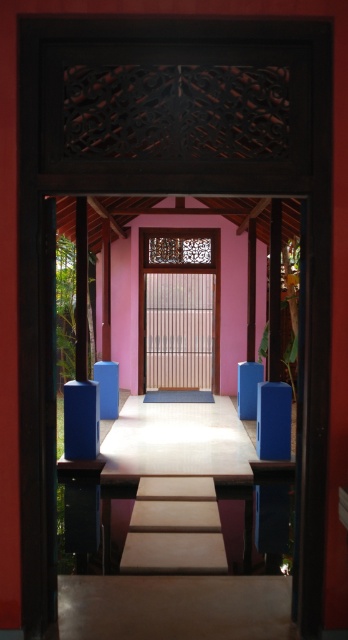
Question: Is wooden screen door at center thinner than blue matte pillar at right?

Choices:
 (A) yes
 (B) no

Answer: (B)

Question: Among these objects, which one is farthest from the camera?

Choices:
 (A) blue matte pillar at right
 (B) wooden screen door at center

Answer: (B)

Question: Does wooden screen door at center have a greater width compared to blue matte pillar at right?

Choices:
 (A) yes
 (B) no

Answer: (A)

Question: Among these objects, which one is nearest to the camera?

Choices:
 (A) wooden screen door at center
 (B) blue matte pillar at right

Answer: (B)

Question: Is wooden screen door at center below blue matte pillar at right?

Choices:
 (A) yes
 (B) no

Answer: (B)